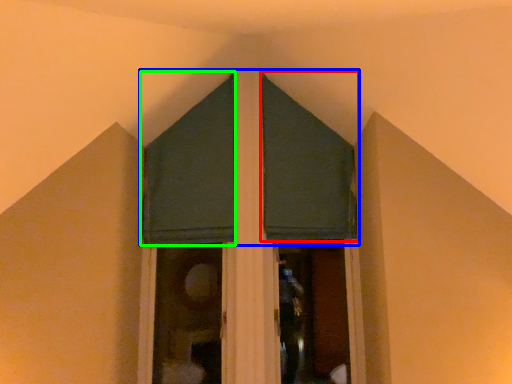
Question: Considering the real-world distances, which object is closest to curtain (highlighted by a red box)? curtain (highlighted by a blue box) or curtain (highlighted by a green box).

Choices:
 (A) curtain
 (B) curtain

Answer: (B)